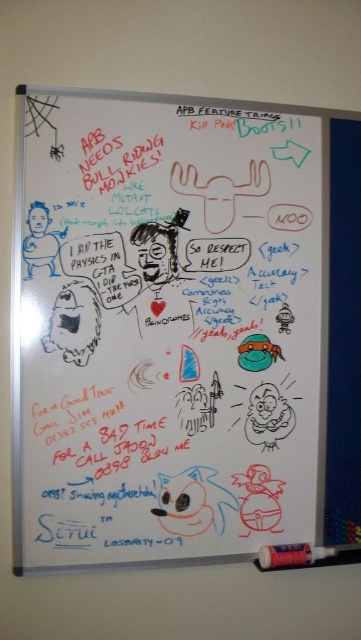
Does point (211, 554) lie in front of point (289, 548)?

That is True.

Does whiteboard at upper center appear on the right side of matte plastic crayon at bottom right?

Incorrect, whiteboard at upper center is not on the right side of matte plastic crayon at bottom right.

Identify the location of whiteboard at upper center. This screenshot has width=361, height=640. (163, 326).